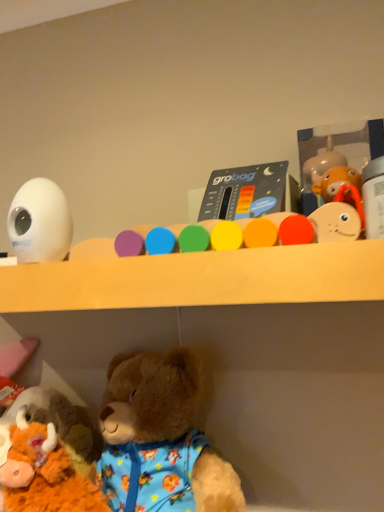
Question: Does white plastic bottle at upper right, which appears as the second toy when viewed from the top, touch fluffy brown teddy bear at lower left, placed as the fourth toy when sorted from top to bottom?

Choices:
 (A) no
 (B) yes

Answer: (A)

Question: Considering the relative sizes of white plastic bottle at upper right, which is counted as the 3th toy, starting from the bottom, and fluffy brown teddy bear at lower left, which is the 1th toy from left to right, in the image provided, is white plastic bottle at upper right, which is counted as the 3th toy, starting from the bottom, smaller than fluffy brown teddy bear at lower left, which is the 1th toy from left to right,?

Choices:
 (A) no
 (B) yes

Answer: (B)

Question: Is white plastic bottle at upper right, which appears as the second toy when viewed from the top, outside fluffy brown teddy bear at lower left, which is the 1th toy from left to right?

Choices:
 (A) no
 (B) yes

Answer: (B)

Question: Considering the relative sizes of white plastic bottle at upper right, which appears as the second toy when viewed from the top, and fluffy brown teddy bear at lower left, which is the 1th toy from left to right, in the image provided, is white plastic bottle at upper right, which appears as the second toy when viewed from the top, bigger than fluffy brown teddy bear at lower left, which is the 1th toy from left to right,?

Choices:
 (A) no
 (B) yes

Answer: (A)

Question: Can you confirm if white plastic bottle at upper right, positioned as the fourth toy in left-to-right order, is thinner than fluffy brown teddy bear at lower left, the fourth toy when ordered from right to left?

Choices:
 (A) yes
 (B) no

Answer: (A)

Question: Looking at their shapes, would you say white plastic bottle at upper right, which appears as the second toy when viewed from the top, is wider or thinner than white glossy egg at upper left, marked as the 3th toy in a right-to-left arrangement?

Choices:
 (A) wide
 (B) thin

Answer: (A)

Question: Is white plastic bottle at upper right, which appears as the second toy when viewed from the top, spatially inside white glossy egg at upper left, the second toy positioned from the left, or outside of it?

Choices:
 (A) inside
 (B) outside

Answer: (B)

Question: From the image's perspective, is white plastic bottle at upper right, which is counted as the 3th toy, starting from the bottom, located above or below white glossy egg at upper left, marked as the 3th toy in a right-to-left arrangement?

Choices:
 (A) below
 (B) above

Answer: (B)

Question: In terms of height, does white plastic bottle at upper right, which appears as the first toy when viewed from the right, look taller or shorter compared to white glossy egg at upper left, arranged as the 2th toy when ordered from the bottom?

Choices:
 (A) short
 (B) tall

Answer: (A)

Question: Is fluffy brown teddy bear at lower left, placed as the fourth toy when sorted from top to bottom, spatially inside matte plastic thermometer at center, arranged as the 3th toy when viewed from the left, or outside of it?

Choices:
 (A) inside
 (B) outside

Answer: (B)

Question: Based on their positions, is fluffy brown teddy bear at lower left, the fourth toy when ordered from right to left, located to the left or right of matte plastic thermometer at center, placed as the 4th toy when sorted from bottom to top?

Choices:
 (A) right
 (B) left

Answer: (B)

Question: Is point (79, 488) positioned closer to the camera than point (274, 186)?

Choices:
 (A) farther
 (B) closer

Answer: (B)

Question: Considering the positions of fluffy brown teddy bear at lower left, the fourth toy when ordered from right to left, and matte plastic thermometer at center, placed as the 2th toy when sorted from right to left, in the image, is fluffy brown teddy bear at lower left, the fourth toy when ordered from right to left, taller or shorter than matte plastic thermometer at center, placed as the 2th toy when sorted from right to left,?

Choices:
 (A) tall
 (B) short

Answer: (A)

Question: Looking at their shapes, would you say white plastic bottle at upper right, which appears as the second toy when viewed from the top, is wider or thinner than matte plastic thermometer at center, which appears as the 1th toy when viewed from the top?

Choices:
 (A) wide
 (B) thin

Answer: (A)

Question: Relative to matte plastic thermometer at center, placed as the 2th toy when sorted from right to left, is white plastic bottle at upper right, which appears as the first toy when viewed from the right, in front or behind?

Choices:
 (A) behind
 (B) front

Answer: (B)